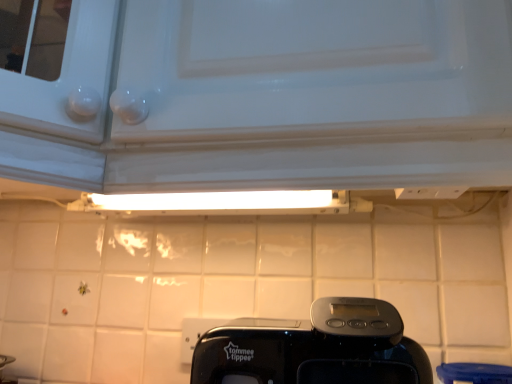
Question: Is black plastic toaster at center outside white glossy tile at lower left?

Choices:
 (A) yes
 (B) no

Answer: (A)

Question: Does black plastic toaster at center have a greater width compared to white glossy tile at lower left?

Choices:
 (A) yes
 (B) no

Answer: (A)

Question: From a real-world perspective, is black plastic toaster at center physically above white glossy tile at lower left?

Choices:
 (A) no
 (B) yes

Answer: (B)

Question: Does black plastic toaster at center have a smaller size compared to white glossy tile at lower left?

Choices:
 (A) no
 (B) yes

Answer: (A)

Question: Considering the relative sizes of black plastic toaster at center and white glossy tile at lower left in the image provided, is black plastic toaster at center bigger than white glossy tile at lower left?

Choices:
 (A) no
 (B) yes

Answer: (B)

Question: Is black plastic toaster at center turned away from white glossy tile at lower left?

Choices:
 (A) yes
 (B) no

Answer: (B)

Question: Can black plastic toaster at center be found inside white glossy tile at lower left?

Choices:
 (A) no
 (B) yes

Answer: (A)

Question: Can you confirm if white glossy tile at lower left is bigger than black plastic toaster at center?

Choices:
 (A) no
 (B) yes

Answer: (A)

Question: Does white glossy tile at lower left appear on the right side of black plastic toaster at center?

Choices:
 (A) no
 (B) yes

Answer: (A)

Question: Considering the relative sizes of white glossy tile at lower left and black plastic toaster at center in the image provided, is white glossy tile at lower left smaller than black plastic toaster at center?

Choices:
 (A) no
 (B) yes

Answer: (B)

Question: Is white glossy tile at lower left closer to the viewer compared to black plastic toaster at center?

Choices:
 (A) no
 (B) yes

Answer: (A)

Question: Can you confirm if white glossy tile at lower left is thinner than black plastic toaster at center?

Choices:
 (A) yes
 (B) no

Answer: (A)

Question: Based on their positions, is white glossy tile at lower left located to the left or right of black plastic toaster at center?

Choices:
 (A) right
 (B) left

Answer: (B)